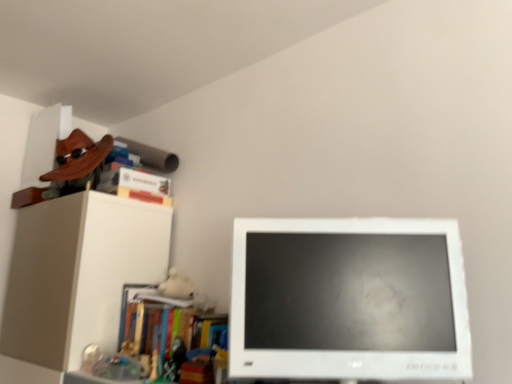
Where is `white glossy computer monitor at center`? This screenshot has width=512, height=384. white glossy computer monitor at center is located at coordinates (348, 300).

What do you see at coordinates (133, 181) in the screenshot? I see `hardcover book at upper left, which is the second book in top-to-bottom order` at bounding box center [133, 181].

The image size is (512, 384). Describe the element at coordinates (74, 168) in the screenshot. I see `wooden skateboard at upper left, marked as the 1th book in a top-to-bottom arrangement` at that location.

How much space does wooden skateboard at upper left, marked as the 1th book in a top-to-bottom arrangement, occupy vertically?

It is 14.24 inches.

Describe the element at coordinates (155, 330) in the screenshot. This screenshot has width=512, height=384. I see `multicolored plastic books at left, the first book positioned from the bottom` at that location.

Identify the location of hardcover book at upper left, the second book positioned from the bottom. (140, 195).

From the image's perspective, between wooden skateboard at upper left, marked as the 1th book in a top-to-bottom arrangement, and white glossy computer monitor at center, who is located below?

white glossy computer monitor at center is shown below in the image.

Does point (82, 171) come closer to viewer compared to point (259, 249)?

No, it is not.

Can you tell me how much wooden skateboard at upper left, the fourth book when ordered from bottom to top, and white glossy computer monitor at center differ in facing direction?

wooden skateboard at upper left, the fourth book when ordered from bottom to top, and white glossy computer monitor at center are facing 39.9 degrees away from each other.

Consider the image. Considering the relative sizes of wooden skateboard at upper left, marked as the 1th book in a top-to-bottom arrangement, and white glossy computer monitor at center in the image provided, is wooden skateboard at upper left, marked as the 1th book in a top-to-bottom arrangement, thinner than white glossy computer monitor at center?

In fact, wooden skateboard at upper left, marked as the 1th book in a top-to-bottom arrangement, might be wider than white glossy computer monitor at center.

Is hardcover book at upper left, which is the 3th book from top to bottom, far away from wooden skateboard at upper left, marked as the 1th book in a top-to-bottom arrangement?

They are positioned close to each other.

Is wooden skateboard at upper left, the fourth book when ordered from bottom to top, at the back of hardcover book at upper left, which is the 3th book from top to bottom?

That's not correct — hardcover book at upper left, which is the 3th book from top to bottom, is not looking away from wooden skateboard at upper left, the fourth book when ordered from bottom to top.

Which book is the 1st one when counting from the back of the wooden skateboard at upper left, the fourth book when ordered from bottom to top? Please provide its 2D coordinates.

[(140, 195)]

Is hardcover book at upper left, the second book positioned from the bottom, next to white glossy computer monitor at center?

No, hardcover book at upper left, the second book positioned from the bottom, is not making contact with white glossy computer monitor at center.

Which of these two, hardcover book at upper left, which is the 3th book from top to bottom, or white glossy computer monitor at center, stands taller?

With more height is white glossy computer monitor at center.

Which is behind, hardcover book at upper left, which is the 3th book from top to bottom, or white glossy computer monitor at center?

hardcover book at upper left, which is the 3th book from top to bottom, is further from the camera.

In terms of width, does hardcover book at upper left, the second book positioned from the bottom, look wider or thinner when compared to white glossy computer monitor at center?

In the image, hardcover book at upper left, the second book positioned from the bottom, appears to be wider than white glossy computer monitor at center.

Considering the positions of points (294, 305) and (65, 188), is point (294, 305) farther from camera compared to point (65, 188)?

No, it is not.

Can you tell me how much white glossy computer monitor at center and wooden skateboard at upper left, the fourth book when ordered from bottom to top, differ in facing direction?

The facing directions of white glossy computer monitor at center and wooden skateboard at upper left, the fourth book when ordered from bottom to top, are 39.9 degrees apart.

From a real-world perspective, is white glossy computer monitor at center above or below wooden skateboard at upper left, the fourth book when ordered from bottom to top?

Clearly, from a real-world perspective, white glossy computer monitor at center is below wooden skateboard at upper left, the fourth book when ordered from bottom to top.

Based on their sizes in the image, would you say white glossy computer monitor at center is bigger or smaller than wooden skateboard at upper left, marked as the 1th book in a top-to-bottom arrangement?

Considering their sizes, white glossy computer monitor at center takes up less space than wooden skateboard at upper left, marked as the 1th book in a top-to-bottom arrangement.

From the image's perspective, who appears lower, multicolored plastic books at left, the first book positioned from the bottom, or hardcover book at upper left, the third book positioned from the bottom?

multicolored plastic books at left, the first book positioned from the bottom, from the image's perspective.

Between point (128, 330) and point (133, 176), which one is positioned behind?

Point (133, 176)

Between multicolored plastic books at left, the first book positioned from the bottom, and hardcover book at upper left, the third book positioned from the bottom, which one has less height?

Standing shorter between the two is hardcover book at upper left, the third book positioned from the bottom.

How many degrees apart are the facing directions of multicolored plastic books at left, marked as the fourth book in a top-to-bottom arrangement, and hardcover book at upper left, the third book positioned from the bottom?

92 degrees separate the facing orientations of multicolored plastic books at left, marked as the fourth book in a top-to-bottom arrangement, and hardcover book at upper left, the third book positioned from the bottom.

Can you confirm if wooden skateboard at upper left, the fourth book when ordered from bottom to top, is wider than hardcover book at upper left, the third book positioned from the bottom?

Yes, wooden skateboard at upper left, the fourth book when ordered from bottom to top, is wider than hardcover book at upper left, the third book positioned from the bottom.

Can we say wooden skateboard at upper left, the fourth book when ordered from bottom to top, lies outside hardcover book at upper left, the third book positioned from the bottom?

Absolutely, wooden skateboard at upper left, the fourth book when ordered from bottom to top, is external to hardcover book at upper left, the third book positioned from the bottom.

From the image's perspective, which one is positioned lower, wooden skateboard at upper left, the fourth book when ordered from bottom to top, or hardcover book at upper left, the third book positioned from the bottom?

hardcover book at upper left, the third book positioned from the bottom, appears lower in the image.

How far apart are wooden skateboard at upper left, marked as the 1th book in a top-to-bottom arrangement, and hardcover book at upper left, the third book positioned from the bottom?

wooden skateboard at upper left, marked as the 1th book in a top-to-bottom arrangement, and hardcover book at upper left, the third book positioned from the bottom, are 4.63 inches apart.

Would you say hardcover book at upper left, the second book positioned from the bottom, is outside multicolored plastic books at left, the first book positioned from the bottom?

Yes, hardcover book at upper left, the second book positioned from the bottom, is located beyond the bounds of multicolored plastic books at left, the first book positioned from the bottom.

Which of these two, hardcover book at upper left, which is the 3th book from top to bottom, or multicolored plastic books at left, marked as the fourth book in a top-to-bottom arrangement, is wider?

multicolored plastic books at left, marked as the fourth book in a top-to-bottom arrangement, is wider.

Find the location of `book that is the 2nd object located behind the multicolored plastic books at left, the first book positioned from the bottom`. book that is the 2nd object located behind the multicolored plastic books at left, the first book positioned from the bottom is located at coordinates (140, 195).

The height and width of the screenshot is (384, 512). In order to click on computer monitor below the wooden skateboard at upper left, the fourth book when ordered from bottom to top (from the image's perspective) in this screenshot , I will do `click(348, 300)`.

The image size is (512, 384). Identify the location of the 2nd book located above the hardcover book at upper left, the second book positioned from the bottom (from a real-world perspective). (74, 168).

When comparing their distances from wooden skateboard at upper left, the fourth book when ordered from bottom to top, does multicolored plastic books at left, the first book positioned from the bottom, or white glossy computer monitor at center seem further?

The object further to wooden skateboard at upper left, the fourth book when ordered from bottom to top, is white glossy computer monitor at center.

Which object lies further to the anchor point hardcover book at upper left, the third book positioned from the bottom, white glossy computer monitor at center or hardcover book at upper left, the second book positioned from the bottom?

white glossy computer monitor at center is positioned further to the anchor hardcover book at upper left, the third book positioned from the bottom.

Looking at the image, which one is located further to hardcover book at upper left, the second book positioned from the bottom, multicolored plastic books at left, marked as the fourth book in a top-to-bottom arrangement, or hardcover book at upper left, which is the second book in top-to-bottom order?

multicolored plastic books at left, marked as the fourth book in a top-to-bottom arrangement, is positioned further to the anchor hardcover book at upper left, the second book positioned from the bottom.

Based on their spatial positions, is wooden skateboard at upper left, marked as the 1th book in a top-to-bottom arrangement, or white glossy computer monitor at center closer to hardcover book at upper left, the second book positioned from the bottom?

Among the two, wooden skateboard at upper left, marked as the 1th book in a top-to-bottom arrangement, is located nearer to hardcover book at upper left, the second book positioned from the bottom.

Estimate the real-world distances between objects in this image. Which object is further from wooden skateboard at upper left, marked as the 1th book in a top-to-bottom arrangement, hardcover book at upper left, which is the 3th book from top to bottom, or hardcover book at upper left, the third book positioned from the bottom?

hardcover book at upper left, which is the 3th book from top to bottom, is positioned further to the anchor wooden skateboard at upper left, marked as the 1th book in a top-to-bottom arrangement.

Which object lies nearer to the anchor point hardcover book at upper left, the third book positioned from the bottom, hardcover book at upper left, the second book positioned from the bottom, or multicolored plastic books at left, the first book positioned from the bottom?

hardcover book at upper left, the second book positioned from the bottom.

From the image, which object appears to be farther from hardcover book at upper left, which is the second book in top-to-bottom order, hardcover book at upper left, the second book positioned from the bottom, or wooden skateboard at upper left, marked as the 1th book in a top-to-bottom arrangement?

wooden skateboard at upper left, marked as the 1th book in a top-to-bottom arrangement.

Considering their positions, is wooden skateboard at upper left, the fourth book when ordered from bottom to top, positioned further to hardcover book at upper left, which is the second book in top-to-bottom order, than multicolored plastic books at left, marked as the fourth book in a top-to-bottom arrangement?

The object further to hardcover book at upper left, which is the second book in top-to-bottom order, is multicolored plastic books at left, marked as the fourth book in a top-to-bottom arrangement.

This screenshot has height=384, width=512. Find the location of `book between wooden skateboard at upper left, the fourth book when ordered from bottom to top, and hardcover book at upper left, the third book positioned from the bottom, from front to back`. book between wooden skateboard at upper left, the fourth book when ordered from bottom to top, and hardcover book at upper left, the third book positioned from the bottom, from front to back is located at coordinates (140, 195).